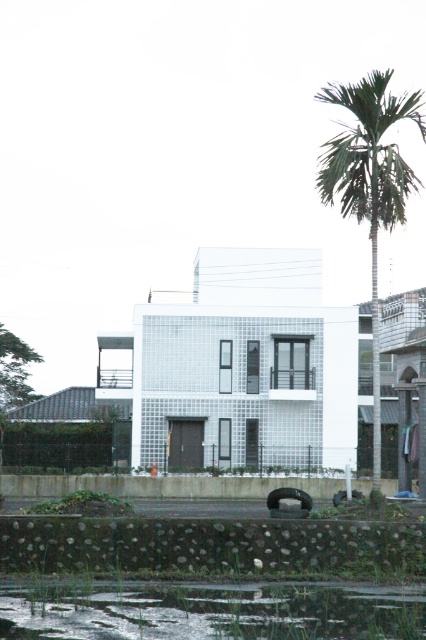
Is clear water at lower center closer to the viewer compared to green leafy palm tree at right?

Yes, clear water at lower center is in front of green leafy palm tree at right.

Is point (54, 630) farther from camera compared to point (409, 193)?

No, (54, 630) is closer to viewer.

Find the location of `clear water at lower center`. clear water at lower center is located at coordinates pyautogui.click(x=212, y=611).

Identify the location of clear water at lower center. (212, 611).